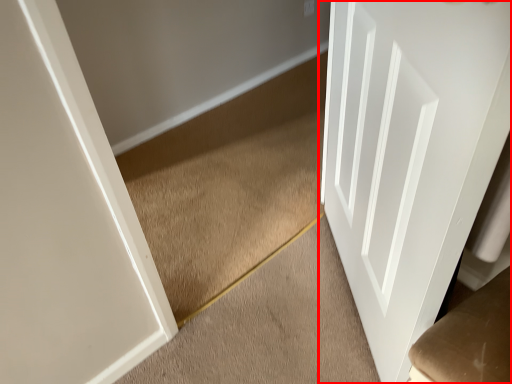
Question: Observing the image, what is the correct spatial positioning of door (annotated by the red box) in reference to stairwell?

Choices:
 (A) left
 (B) right

Answer: (B)